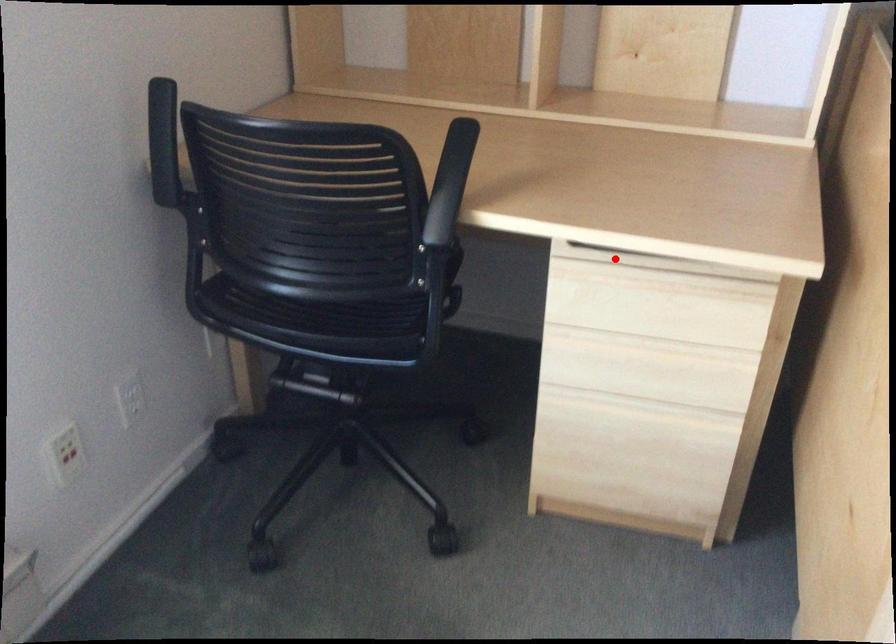
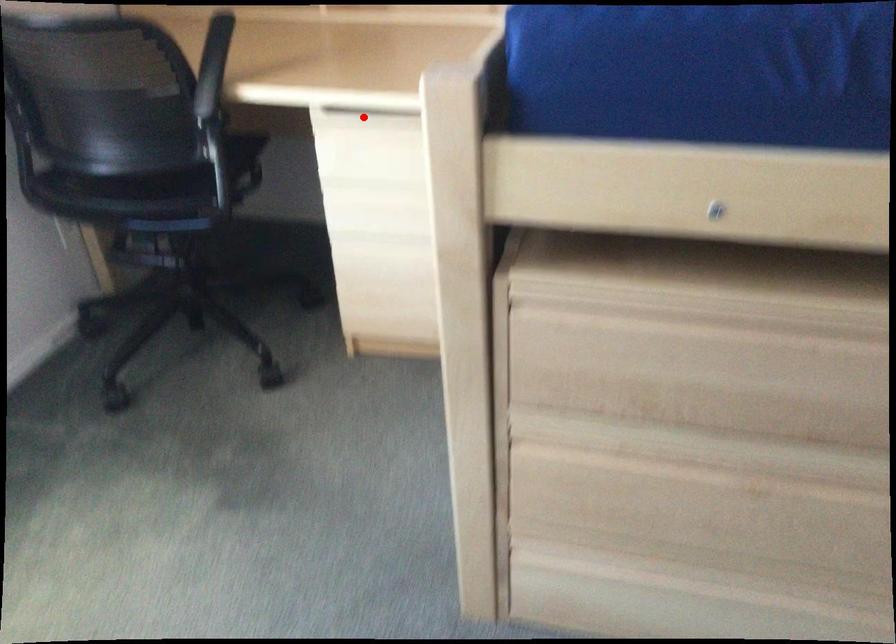
I am providing you with two images of the same scene from different viewpoints. A red point is marked on the first image and another point is marked on the second image. Is the marked point in image1 the same physical position as the marked point in image2?

Yes